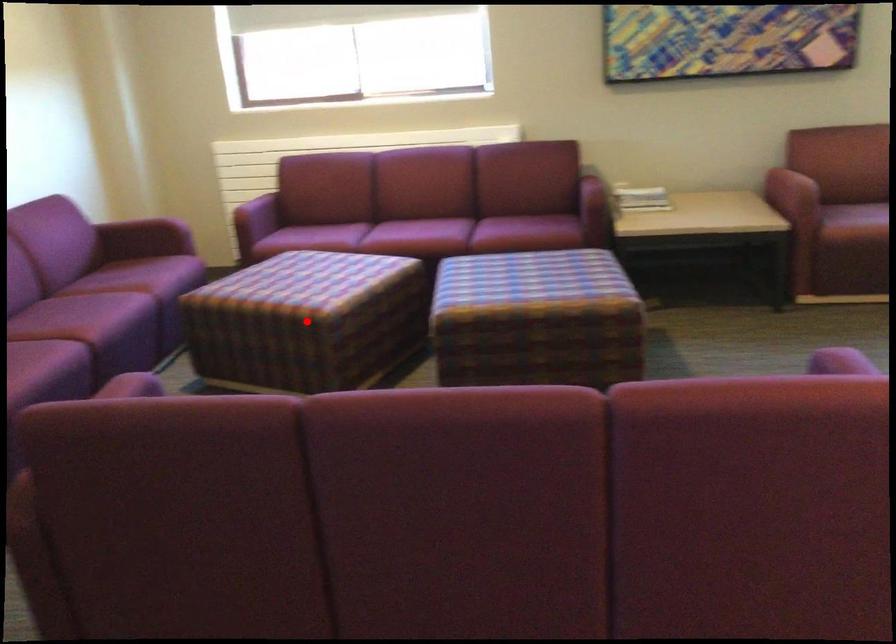
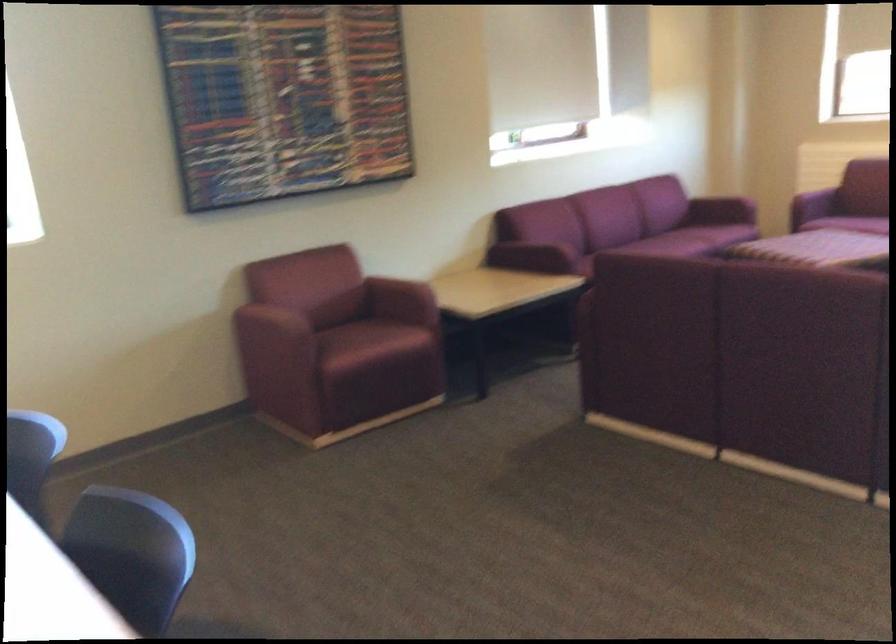
Question: I am providing you with two images of the same scene from different viewpoints. A red point is marked on the first image. Is the red point's position out of view in image 2?

Choices:
 (A) Yes
 (B) No

Answer: (A)